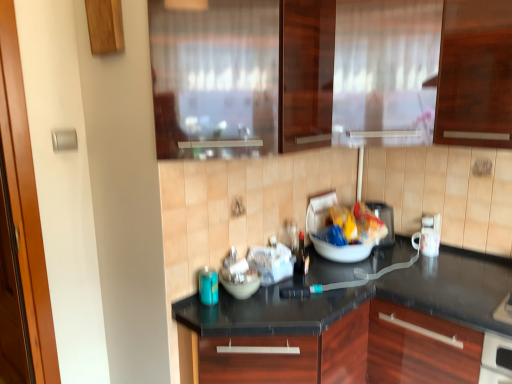
Locate an element on the screen. unoccupied region to the right of blue glass bottle at lower left, which is the 3th appliance from back to front is located at coordinates (254, 305).